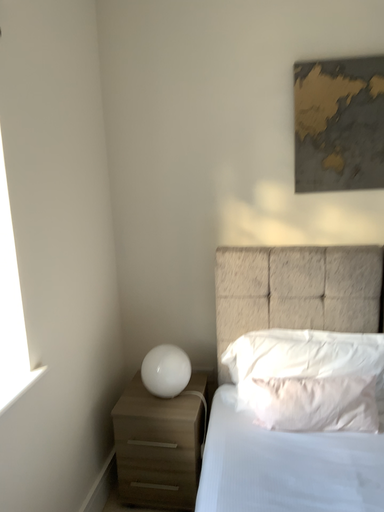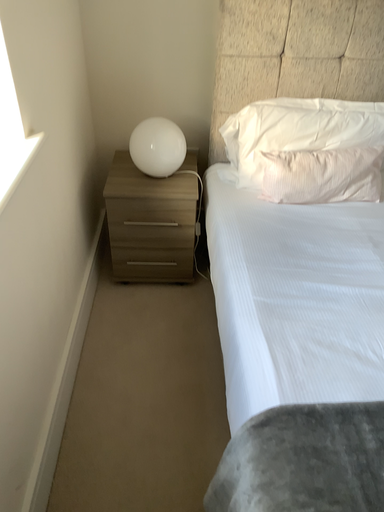
Question: How did the camera likely rotate when shooting the video?

Choices:
 (A) rotated left
 (B) rotated right

Answer: (B)